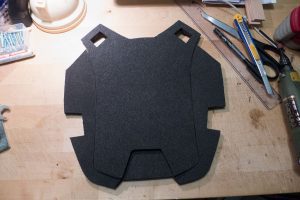
Image resolution: width=300 pixels, height=200 pixels. What are the coordinates of `cutting board` in the screenshot? It's located at (263, 149), (156, 190), (39, 161), (50, 90), (116, 16), (149, 86).